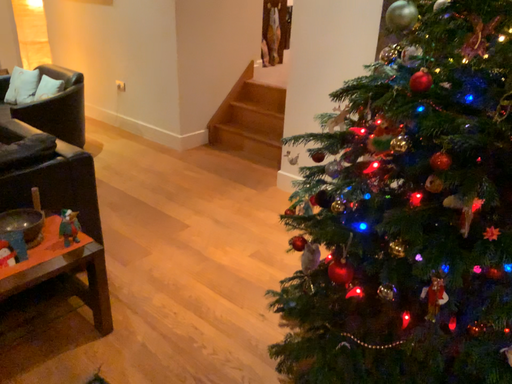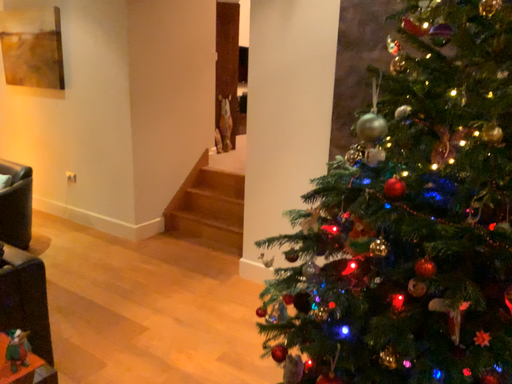
Question: Which way did the camera rotate in the video?

Choices:
 (A) rotated right
 (B) rotated left

Answer: (A)